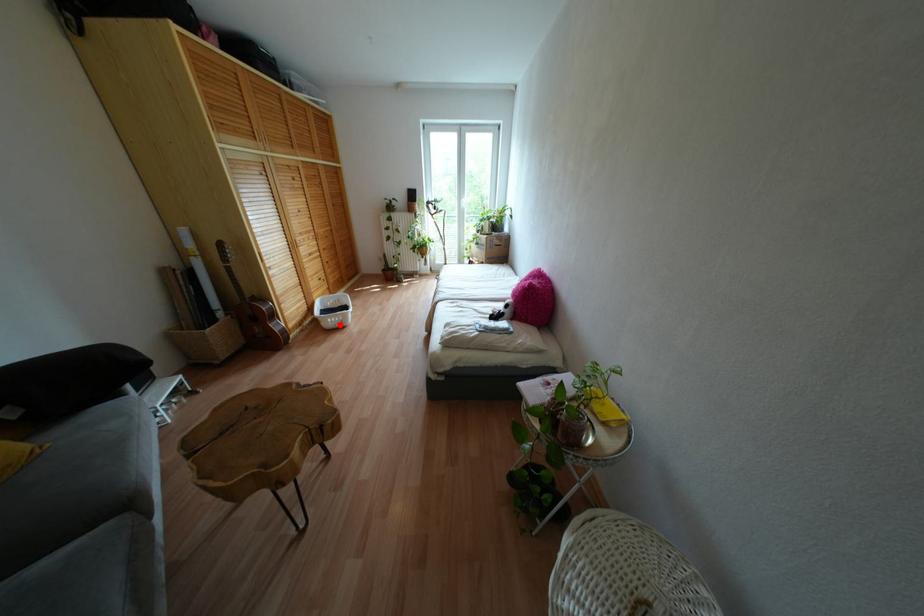
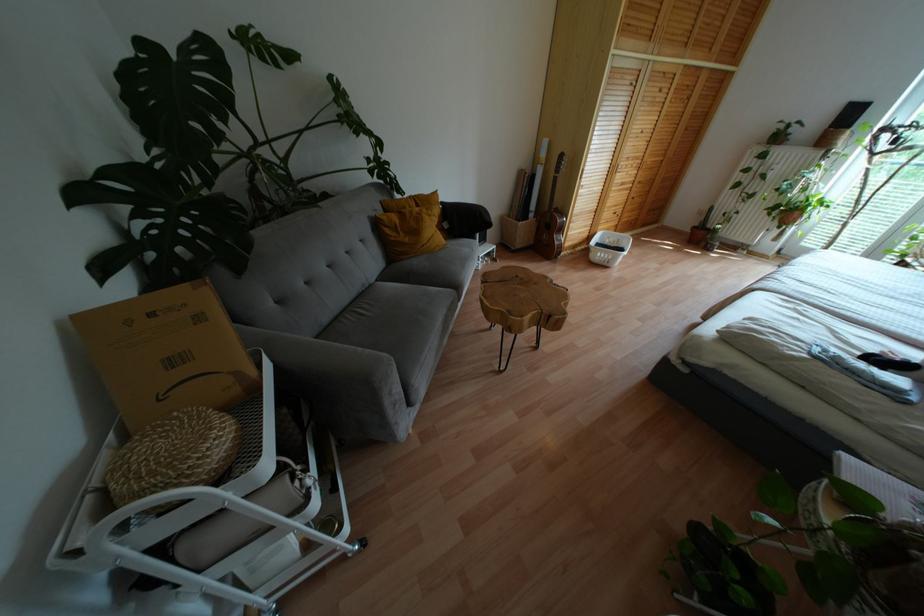
Find the pixel in the second image that matches the highlighted location in the first image.

(604, 262)